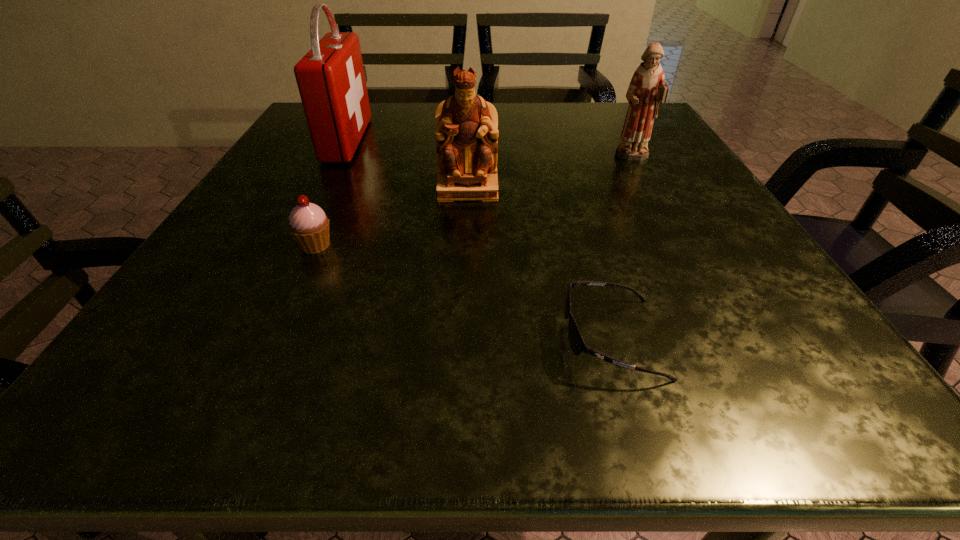
I want to click on free space that satisfies the following two spatial constraints: 1. on the front face of the fourth tallest object; 2. on the left side of the tallest object, so click(x=294, y=245).

Image resolution: width=960 pixels, height=540 pixels. What are the coordinates of `free space that satisfies the following two spatial constraints: 1. on the front-facing side of the rightmost object; 2. on the front-facing side of the fourth object from left to right` in the screenshot? It's located at (731, 338).

The height and width of the screenshot is (540, 960). Find the location of `vacant area that satisfies the following two spatial constraints: 1. on the front face of the first-aid kit; 2. on the right side of the fourth tallest object`. vacant area that satisfies the following two spatial constraints: 1. on the front face of the first-aid kit; 2. on the right side of the fourth tallest object is located at coordinates (294, 245).